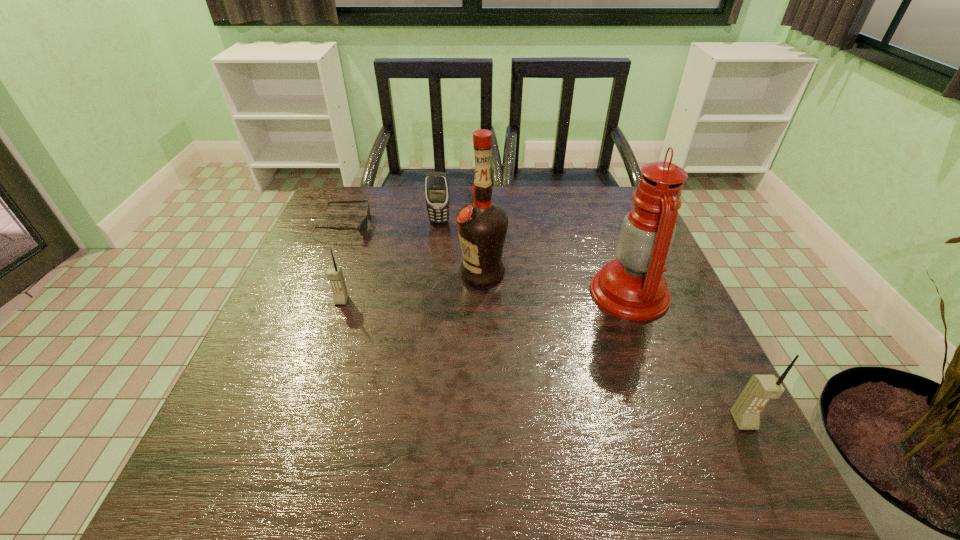
The image size is (960, 540). Find the location of `vacant space located on the lenses of the sunglasses`. vacant space located on the lenses of the sunglasses is located at coordinates (444, 226).

At what (x,y) coordinates should I click in order to perform the action: click on vacant area situated 0.200m on the front of the oil lamp. Please return your answer as a coordinate pair (x, y). The width and height of the screenshot is (960, 540). Looking at the image, I should click on (671, 404).

Where is `vacant space located 0.140m on the front and back of the liquor`? vacant space located 0.140m on the front and back of the liquor is located at coordinates (402, 273).

Find the location of a particular element. This screenshot has height=540, width=960. vacant region located 0.220m on the front and back of the liquor is located at coordinates (371, 273).

Where is `vacant space situated 0.050m on the front and back of the liquor`? Image resolution: width=960 pixels, height=540 pixels. vacant space situated 0.050m on the front and back of the liquor is located at coordinates (439, 273).

I want to click on cellular telephone that is positioned at the far edge, so click(436, 183).

Locate an element on the screen. sunglasses that is at the far edge is located at coordinates (362, 228).

I want to click on object at the near edge, so click(x=760, y=389).

You are a GUI agent. You are given a task and a screenshot of the screen. Output one action in this format:
    pyautogui.click(x=<x>, y=<y>)
    Task: Click on the cellular telephone present at the left edge
    
    Given the screenshot: What is the action you would take?
    pyautogui.click(x=334, y=274)

The height and width of the screenshot is (540, 960). In order to click on sunglasses that is at the left edge in this screenshot , I will do `click(362, 228)`.